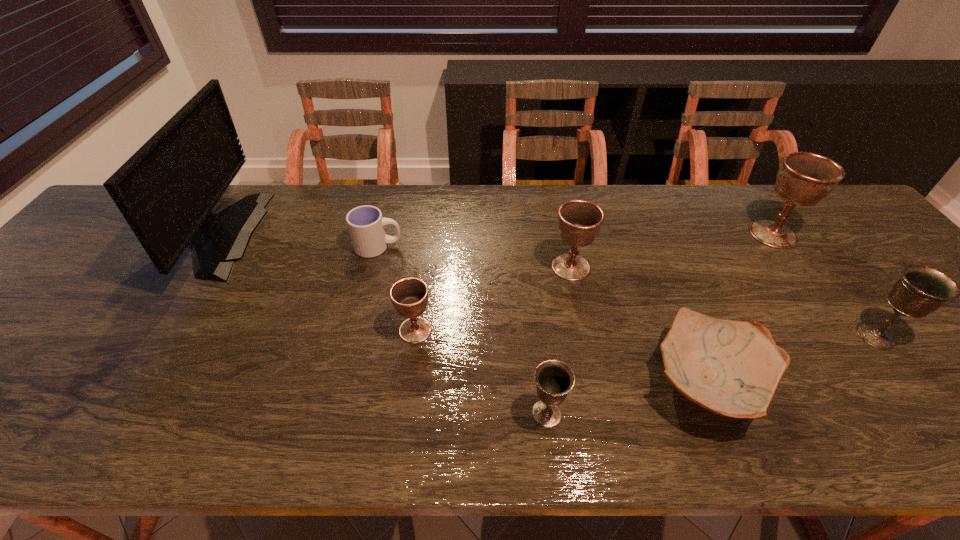
You are a GUI agent. You are given a task and a screenshot of the screen. Output one action in this format:
    pyautogui.click(x=<x>, y=<y>)
    Task: Click on the vacant space that satisfies the following two spatial constraints: 1. on the screen side of the tallest object; 2. on the left side of the second chalice from left to right
    The image size is (960, 540).
    Given the screenshot: What is the action you would take?
    pyautogui.click(x=106, y=414)

The image size is (960, 540). In order to click on vacant area in the image that satisfies the following two spatial constraints: 1. on the back side of the pottery; 2. on the screen side of the tallest object in this screenshot , I will do `click(646, 234)`.

Where is `free spot that satisfies the following two spatial constraints: 1. with the handle on the side of the cup; 2. on the right side of the farther bronze chalice`? free spot that satisfies the following two spatial constraints: 1. with the handle on the side of the cup; 2. on the right side of the farther bronze chalice is located at coordinates (357, 335).

The height and width of the screenshot is (540, 960). What are the coordinates of `free location that satisfies the following two spatial constraints: 1. on the screen side of the leftmost object; 2. on the right side of the right bronze chalice` in the screenshot? It's located at (155, 335).